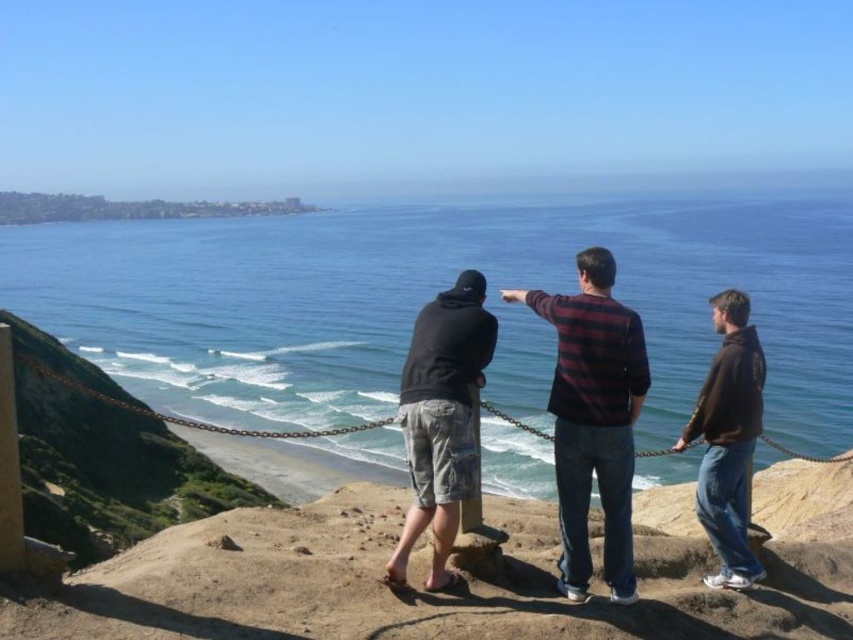
Who is shorter, sandy beach at lower center or brown chain at center?

sandy beach at lower center

Who is more distant from viewer, (643, 541) or (280, 436)?

Positioned behind is point (643, 541).

I want to click on sandy beach at lower center, so [x=469, y=579].

Between sandy beach at lower center and striped sweater at center, which one is positioned higher?

striped sweater at center

How much distance is there between sandy beach at lower center and striped sweater at center?

17.38 feet

Is point (662, 548) positioned after point (589, 438)?

Yes.

Identify the location of sandy beach at lower center. (469, 579).

Who is more forward, (627, 280) or (469, 275)?

Point (469, 275) is in front.

Between blue water at center and dark gray hoodie at center, which one is positioned lower?

dark gray hoodie at center

Who is more distant from viewer, (202, 264) or (401, 401)?

Positioned behind is point (202, 264).

The height and width of the screenshot is (640, 853). What are the coordinates of `blue water at center` in the screenshot? It's located at (x=432, y=296).